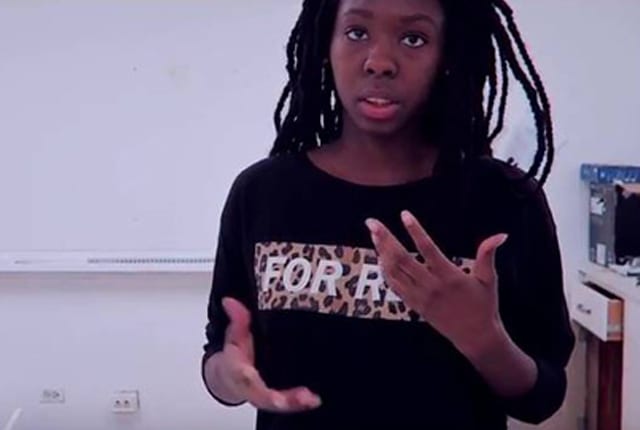
Where is `drawer`? drawer is located at coordinates (592, 323).